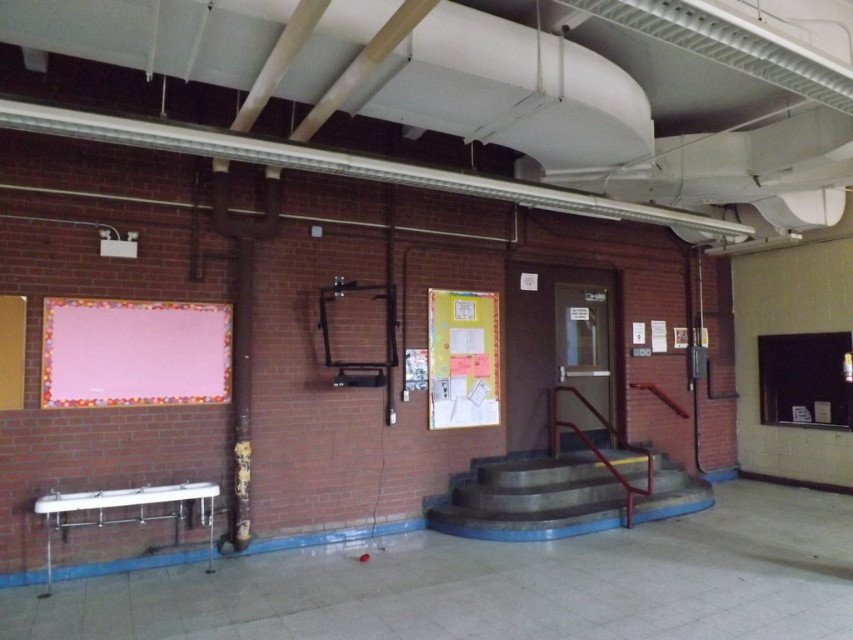
You are a teacher preparing for a class and need to hang a poster. You have two options on the wall where to place it. The pink fabric board at left and the yellow paperboard bulletin board at center. Which board is located above the other?

The pink fabric board at left is positioned over the yellow paperboard bulletin board at center.

You are organizing a school event and need to display a large poster. Which object between the pink fabric board at left and the yellow paperboard bulletin board at center would be more suitable for the task?

The pink fabric board at left is bigger than the yellow paperboard bulletin board at center, so it would be more suitable for displaying a large poster.